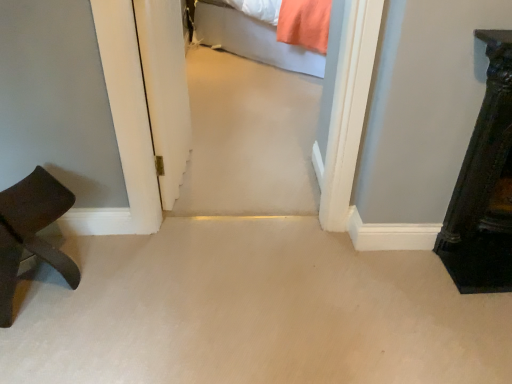
I want to click on empty space that is to the right of dark brown wood stool at left, the 1th furniture positioned from the left, so click(x=116, y=284).